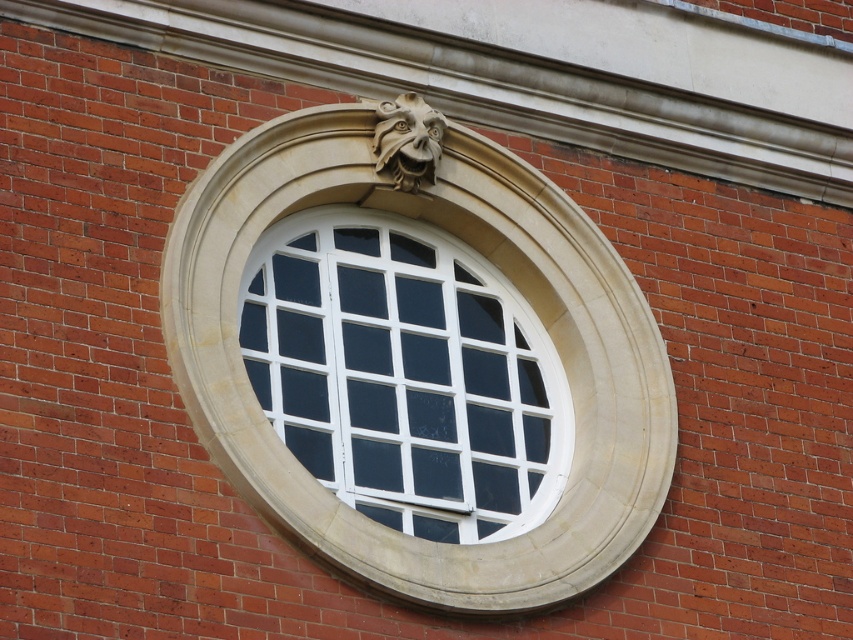
You are standing in front of the circular window and want to touch the white stone window frame at center. Based on the coordinates provided, where should you aim your hand to reach it?

You should aim your hand at the coordinates point (419, 364) to reach the white stone window frame at center.

You are standing in front of a historic building with a circular window framed by a stone archway. You notice two points marked on the wall. One is at coordinate point (505,513) and the other at point (405,176). From your perspective, which point is closer to you?

Point (505,513) is in front of point (405,176), so it is closer to you.

You are an architect examining the circular window in the image. You notice two central elements, the white stone window frame at center and the white glass window at center. From your perspective, which one is positioned more to the left?

The white stone window frame at center is positioned to the left of the white glass window at center, so it is more to the left.